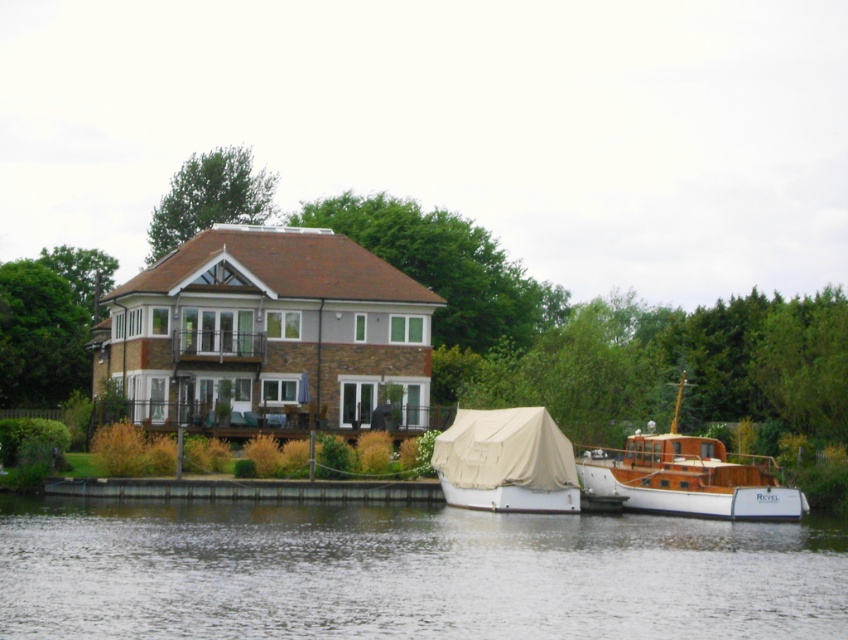
You are standing on the dock and want to check the water level near the wooden boat at right. According to the scene, where would you look to see the transparent water at lower center?

The transparent water at lower center is located below the wooden boat at right, so you should look downward beneath the wooden boat at right to see it.

You are standing on the dock and want to know if you can safely walk from the wooden boat at right to the transparent water at lower center without getting your feet wet. The safe walking distance without getting wet is up to 50 feet. Can you make this walk?

The distance between the wooden boat at right and the transparent water at lower center is 43.85 feet, which is within the safe walking distance of 50 feet. Therefore, you can walk from the wooden boat at right to the transparent water at lower center without getting your feet wet.

You are standing on the dock and want to check the water level. Where exactly is the transparent water at lower center located in the image?

The transparent water at lower center is located at point coordinates of 0.895 on the x axis and 0.480 on the y axis.